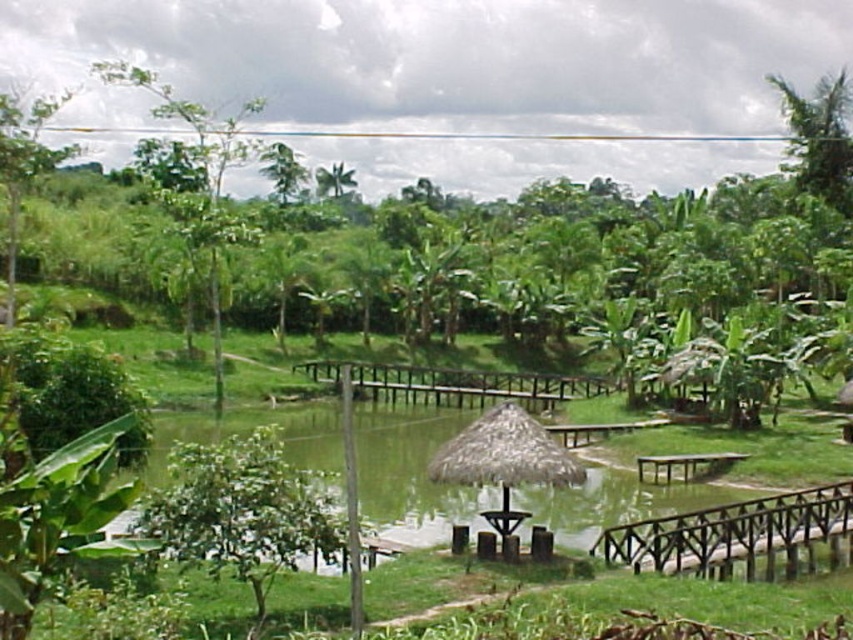
Between green leafy palm at upper right and green leafy palm at upper center, which one has less height?

green leafy palm at upper center is shorter.

Based on the photo, which is below, green leafy palm at upper right or green leafy palm at upper center?

green leafy palm at upper right

Where is `green leafy palm at upper right`? green leafy palm at upper right is located at coordinates (820, 138).

Who is taller, green leafy tree at lower left or green leafy tree at left?

Standing taller between the two is green leafy tree at left.

Which is behind, point (270, 468) or point (192, 128)?

The point (192, 128) is more distant.

At what (x,y) coordinates should I click in order to perform the action: click on green leafy tree at lower left. Please return your answer as a coordinate pair (x, y). The image size is (853, 640). Looking at the image, I should click on (242, 509).

Is green leafy tree at lower left bigger than green wooden picnic table at lower right?

Correct, green leafy tree at lower left is larger in size than green wooden picnic table at lower right.

Does green leafy tree at lower left have a greater height compared to green wooden picnic table at lower right?

Indeed, green leafy tree at lower left has a greater height compared to green wooden picnic table at lower right.

I want to click on green leafy tree at lower left, so click(x=242, y=509).

You are a GUI agent. You are given a task and a screenshot of the screen. Output one action in this format:
    pyautogui.click(x=<x>, y=<y>)
    Task: Click on the green leafy tree at lower left
    
    Given the screenshot: What is the action you would take?
    pyautogui.click(x=242, y=509)